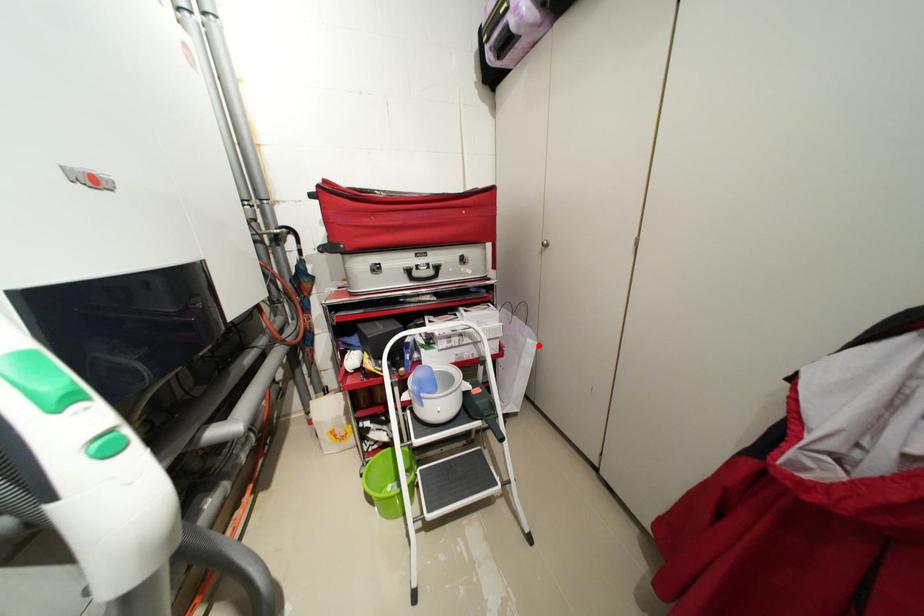
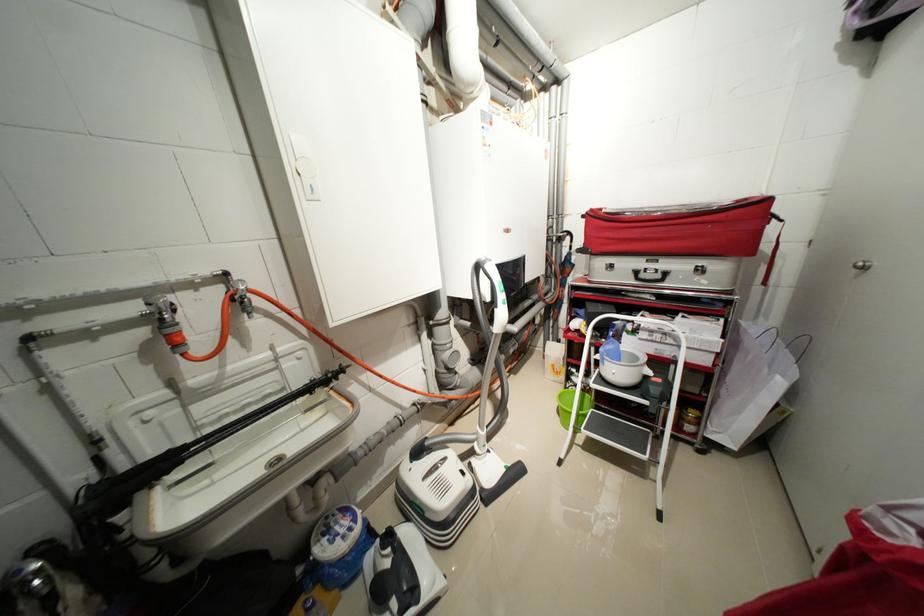
Where in the second image is the point corresponding to the highlighted location from the first image?

(787, 384)